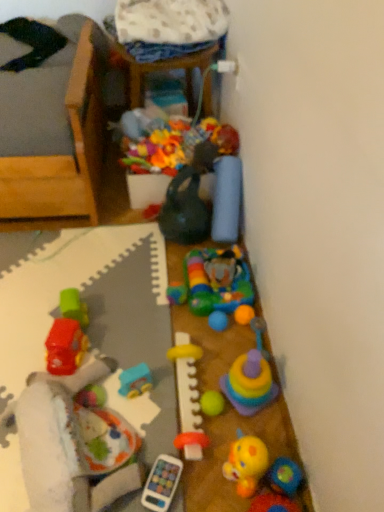
Find the location of a particular element. This screenshot has height=512, width=384. free space to the left of blue plastic toy car at center, positioned as the tenth toy in right-to-left order is located at coordinates (103, 378).